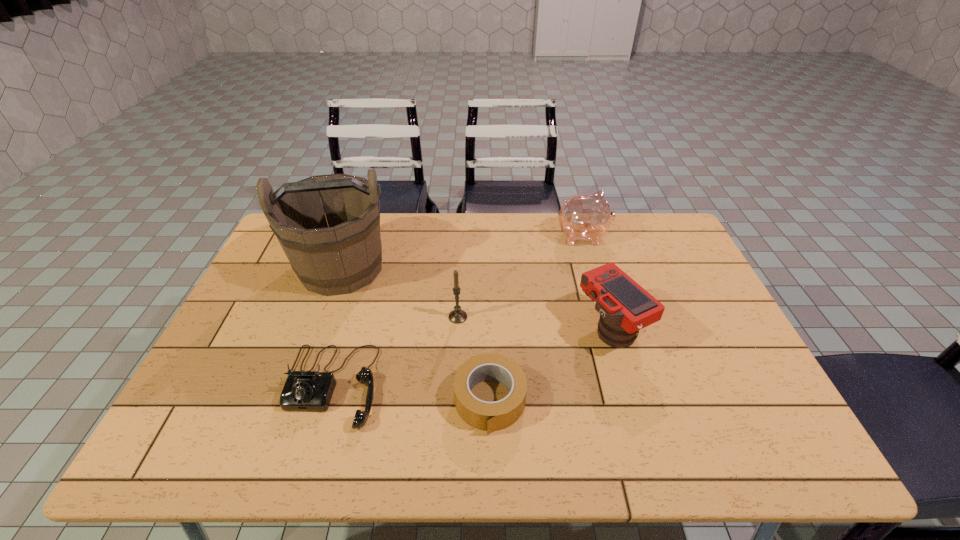
Find the location of a particular element. This screenshot has height=540, width=960. vacant region at the right edge of the desktop is located at coordinates (718, 316).

Identify the location of free space at the far right corner of the desktop. The width and height of the screenshot is (960, 540). (650, 244).

Locate an element on the screen. The image size is (960, 540). free space between the tallest object and the candle is located at coordinates (399, 292).

The image size is (960, 540). Identify the location of unoccupied position between the piggy bank and the bucket. (462, 252).

Where is `vacant space that's between the bucket and the camera`? The width and height of the screenshot is (960, 540). vacant space that's between the bucket and the camera is located at coordinates (476, 298).

At what (x,y) coordinates should I click in order to perform the action: click on empty space between the tallest object and the camera. Please return your answer as a coordinate pair (x, y). Looking at the image, I should click on (476, 298).

This screenshot has width=960, height=540. I want to click on vacant area between the camera and the duct tape, so click(550, 364).

The width and height of the screenshot is (960, 540). I want to click on free spot between the second shortest object and the shortest object, so click(x=411, y=394).

You are a GUI agent. You are given a task and a screenshot of the screen. Output one action in this format:
    pyautogui.click(x=<x>, y=<y>)
    Task: Click on the free space between the tallest object and the camera
    Image resolution: width=960 pixels, height=540 pixels.
    Given the screenshot: What is the action you would take?
    pyautogui.click(x=476, y=298)

Where is `free spot between the shortest object and the bucket`? The width and height of the screenshot is (960, 540). free spot between the shortest object and the bucket is located at coordinates (416, 334).